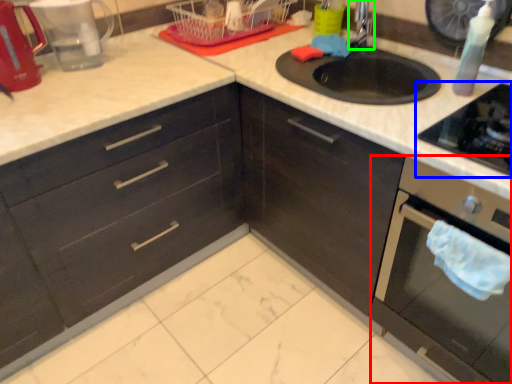
Question: Based on their relative distances, which object is nearer to oven (highlighted by a red box)? Choose from gas stove (highlighted by a blue box) and faucet (highlighted by a green box).

Choices:
 (A) gas stove
 (B) faucet

Answer: (A)